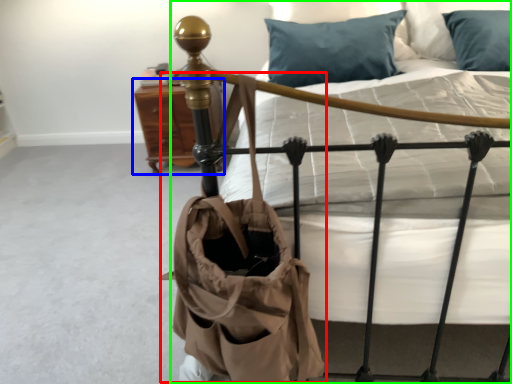
Question: Which is farther away from shoulder bag (highlighted by a red box)? nightstand (highlighted by a blue box) or bed (highlighted by a green box)?

Choices:
 (A) nightstand
 (B) bed

Answer: (A)